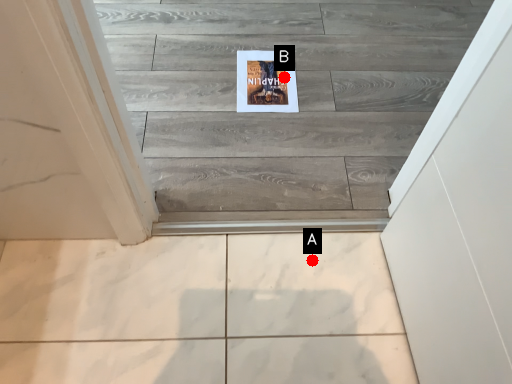
Question: Two points are circled on the image, labeled by A and B beside each circle. Which point is farther to the camera?

Choices:
 (A) A is further
 (B) B is further

Answer: (B)